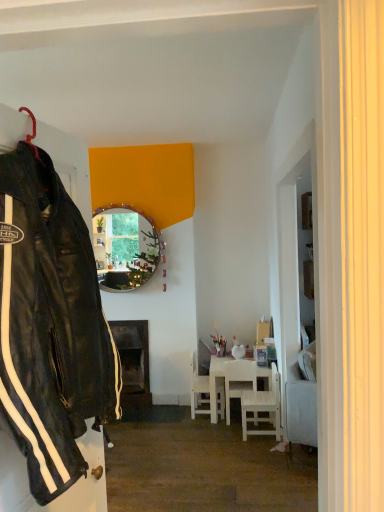
Where is `free space below white wooden chair at lower right, positioned as the third chair in back-to-front order (from a real-world perspective)`? free space below white wooden chair at lower right, positioned as the third chair in back-to-front order (from a real-world perspective) is located at coordinates (254, 432).